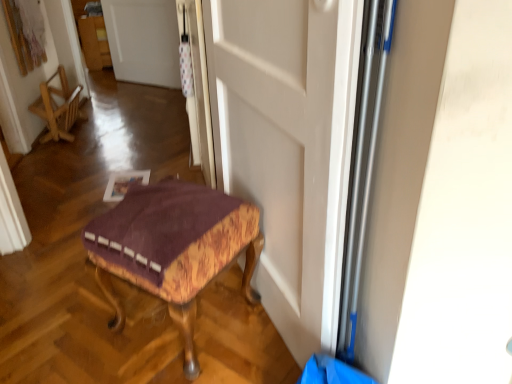
Question: Is wooden chair at left not within white glossy door at upper center, which is the first door from top to bottom?

Choices:
 (A) no
 (B) yes

Answer: (B)

Question: Is wooden chair at left next to white glossy door at upper center, which is the second door in front-to-back order?

Choices:
 (A) yes
 (B) no

Answer: (B)

Question: Is wooden chair at left aimed at white glossy door at upper center, which is the first door from top to bottom?

Choices:
 (A) no
 (B) yes

Answer: (A)

Question: Is wooden chair at left positioned behind white glossy door at upper center, the second door ordered from the bottom?

Choices:
 (A) no
 (B) yes

Answer: (A)

Question: From the image's perspective, is wooden chair at left below white glossy door at upper center, positioned as the first door in back-to-front order?

Choices:
 (A) yes
 (B) no

Answer: (A)

Question: From a real-world perspective, is white glossy door at upper center, positioned as the first door in back-to-front order, above or below wooden chair at left?

Choices:
 (A) above
 (B) below

Answer: (A)

Question: Is point (119, 54) closer or farther from the camera than point (74, 102)?

Choices:
 (A) closer
 (B) farther

Answer: (B)

Question: Based on their sizes in the image, would you say white glossy door at upper center, which ranks as the first door in left-to-right order, is bigger or smaller than wooden chair at left?

Choices:
 (A) small
 (B) big

Answer: (B)

Question: Looking at their shapes, would you say white glossy door at upper center, the second door ordered from the bottom, is wider or thinner than wooden chair at left?

Choices:
 (A) thin
 (B) wide

Answer: (A)

Question: Choose the correct answer: Is wooden chair at left inside velvet purple cushioned stool at lower center or outside it?

Choices:
 (A) inside
 (B) outside

Answer: (B)

Question: Visually, is wooden chair at left positioned to the left or to the right of velvet purple cushioned stool at lower center?

Choices:
 (A) left
 (B) right

Answer: (A)

Question: Relative to velvet purple cushioned stool at lower center, is wooden chair at left in front or behind?

Choices:
 (A) behind
 (B) front

Answer: (A)

Question: From the image's perspective, is wooden chair at left above or below velvet purple cushioned stool at lower center?

Choices:
 (A) below
 (B) above

Answer: (B)

Question: From a real-world perspective, is velvet purple cushioned stool at lower center positioned above or below white glossy door at upper center, the second door ordered from the bottom?

Choices:
 (A) below
 (B) above

Answer: (A)

Question: Which is correct: velvet purple cushioned stool at lower center is inside white glossy door at upper center, which ranks as the first door in left-to-right order, or outside of it?

Choices:
 (A) outside
 (B) inside

Answer: (A)